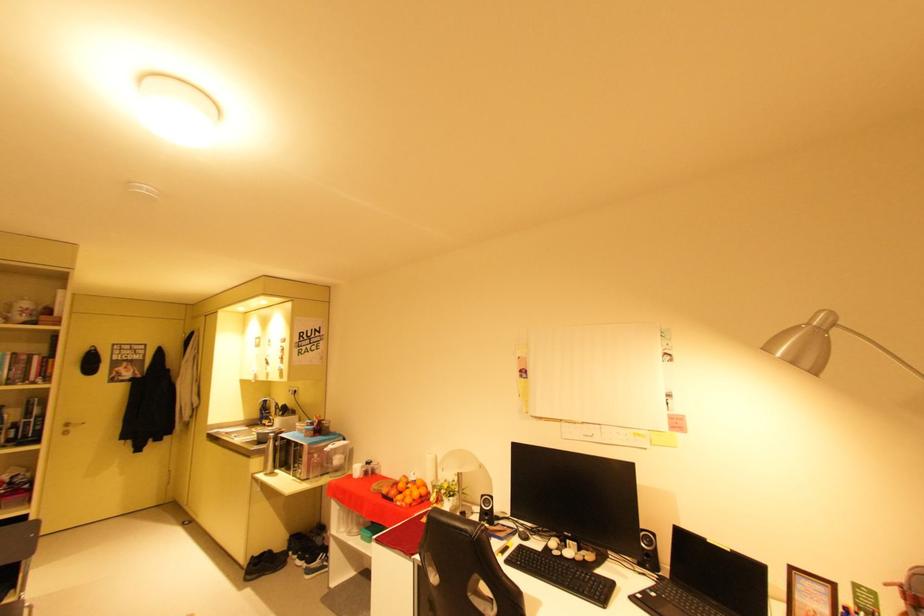
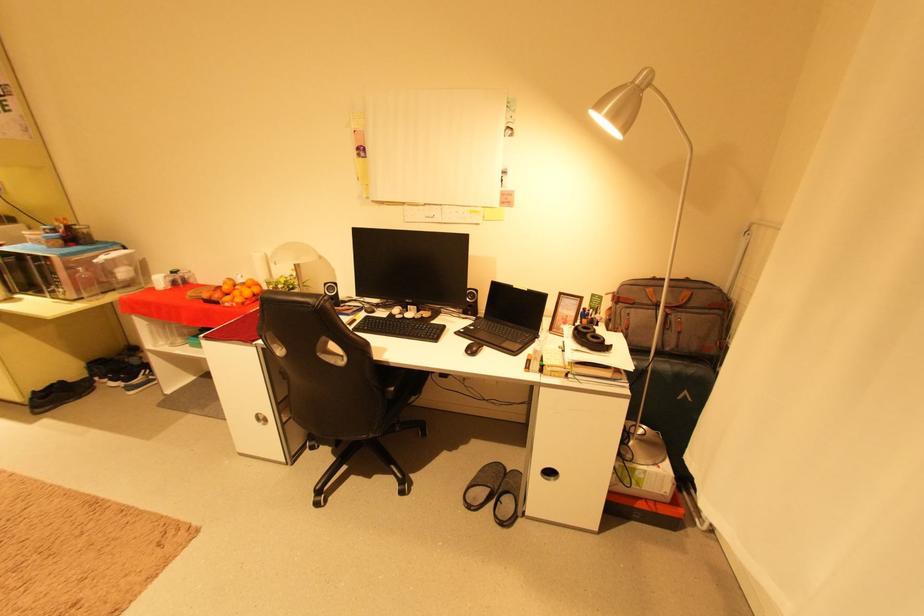
Where in the second image is the point corresponding to pixel 406 504 from the first image?

(235, 305)